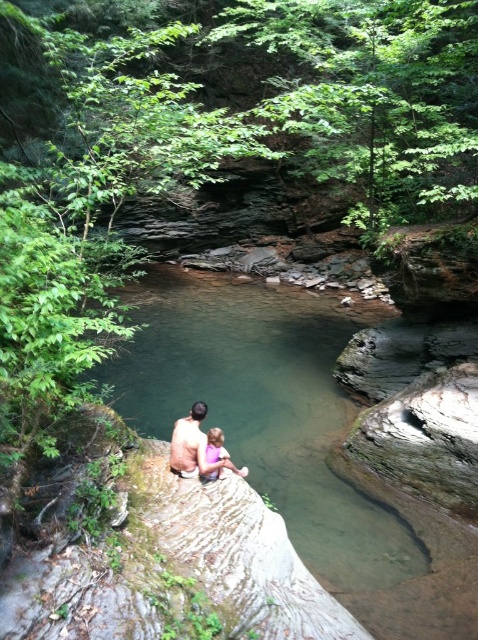
Does smooth skin man at center have a lesser height compared to pink fabric at center?

In fact, smooth skin man at center may be taller than pink fabric at center.

Which is below, smooth skin man at center or pink fabric at center?

pink fabric at center

The height and width of the screenshot is (640, 478). In order to click on smooth skin man at center in this screenshot , I will do click(x=191, y=445).

Is point (148, 403) positioned behind point (206, 404)?

Yes.

Which is behind, point (286, 365) or point (172, 458)?

The point (286, 365) is behind.

Image resolution: width=478 pixels, height=640 pixels. In order to click on clear water at center in this screenshot , I will do `click(260, 410)`.

Does clear water at center have a greater height compared to pink fabric at center?

Yes, clear water at center is taller than pink fabric at center.

Based on the photo, does clear water at center have a smaller size compared to pink fabric at center?

No.

Describe the element at coordinates (260, 410) in the screenshot. Image resolution: width=478 pixels, height=640 pixels. I see `clear water at center` at that location.

Identify the location of clear water at center. Image resolution: width=478 pixels, height=640 pixels. (260, 410).